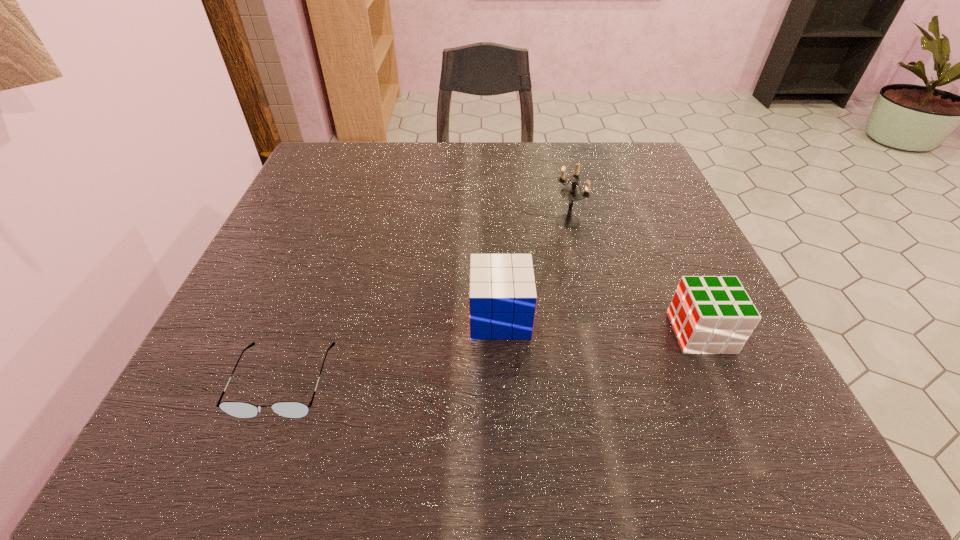
Find the location of a particular element. Image resolution: width=960 pixels, height=540 pixels. vacant space located on the red face of the rightmost object is located at coordinates (572, 333).

Locate an element on the screen. Image resolution: width=960 pixels, height=540 pixels. object that is at the near edge is located at coordinates (291, 409).

This screenshot has width=960, height=540. In order to click on object present at the left edge in this screenshot , I will do `click(291, 409)`.

The height and width of the screenshot is (540, 960). I want to click on object at the right edge, so click(x=709, y=314).

The width and height of the screenshot is (960, 540). In order to click on object present at the near left corner in this screenshot , I will do `click(291, 409)`.

Find the location of a particular element. This screenshot has width=960, height=540. vacant space at the far edge is located at coordinates (522, 173).

Identify the location of vacant space at the near edge of the desktop. (660, 418).

Identify the location of vacant region at the right edge of the desktop. The image size is (960, 540). (723, 373).

I want to click on free location at the far left corner of the desktop, so click(x=343, y=150).

Find the location of a particular element. The height and width of the screenshot is (540, 960). free space at the far right corner of the desktop is located at coordinates (636, 154).